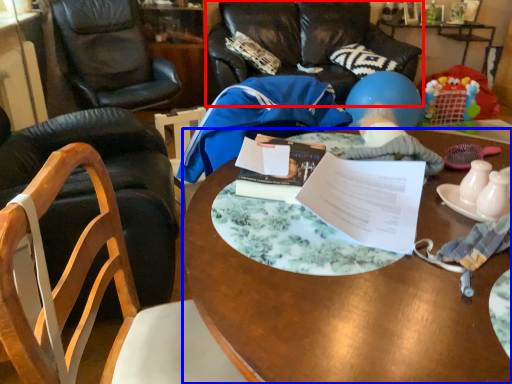
Question: Which point is closer to the camera, chair (highlighted by a red box) or desk (highlighted by a blue box)?

Choices:
 (A) chair
 (B) desk

Answer: (B)